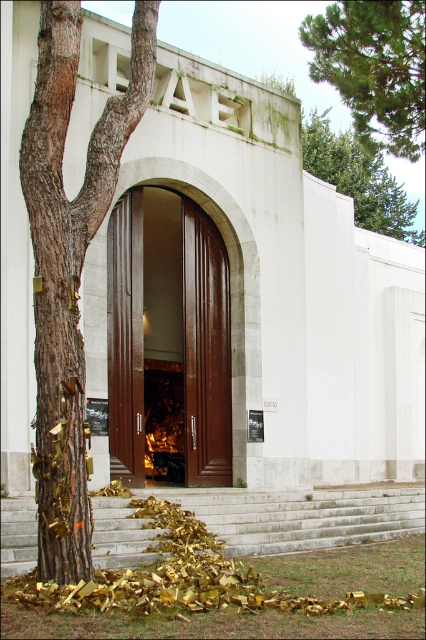
Can you confirm if brown polished wood door at center is wider than green mossy wall at upper center?

No.

Between brown polished wood door at center and green mossy wall at upper center, which one is positioned lower?

brown polished wood door at center is lower down.

Measure the distance between brown polished wood door at center and camera.

15.89 meters

This screenshot has height=640, width=426. In order to click on brown polished wood door at center in this screenshot , I will do (206, 352).

Who is positioned more to the right, white stone stairs at center or brown polished wood door at center?

From the viewer's perspective, white stone stairs at center appears more on the right side.

This screenshot has height=640, width=426. I want to click on white stone stairs at center, so click(301, 515).

Which is behind, point (181, 244) or point (405, 241)?

The point (405, 241) is behind.

The width and height of the screenshot is (426, 640). What are the coordinates of `brown wooden door at center` in the screenshot? It's located at (169, 349).